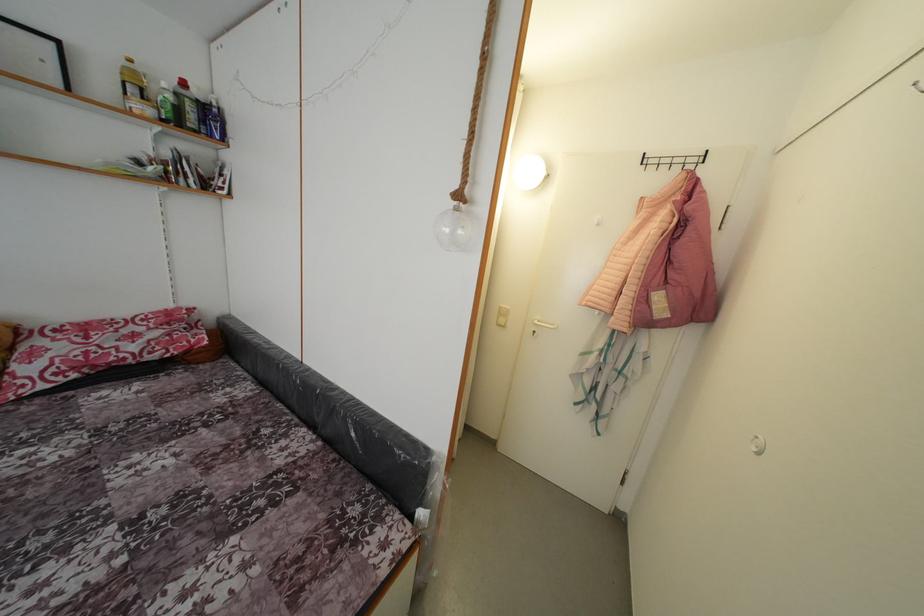
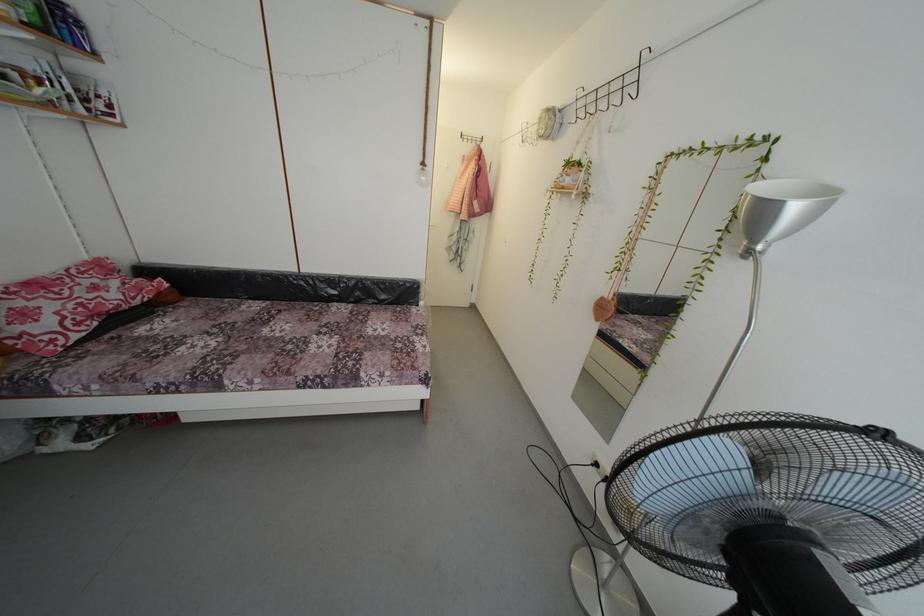
In the second image, find the point that corresponds to the point at 75,459 in the first image.

(225, 345)